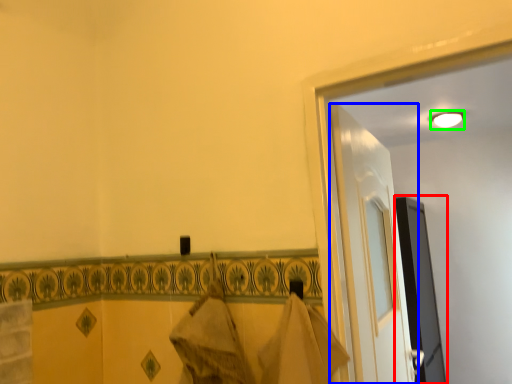
Question: Which object is the farthest from screen door (highlighted by a red box)? Choose among these: door (highlighted by a blue box) or light (highlighted by a green box).

Choices:
 (A) door
 (B) light

Answer: (A)